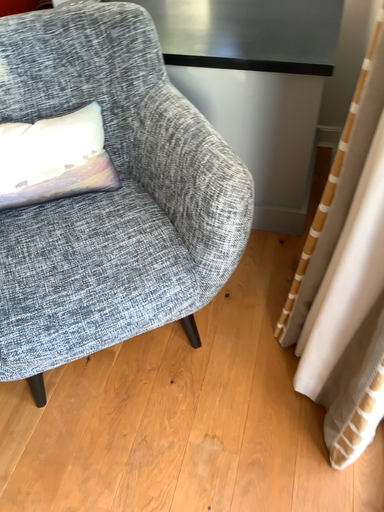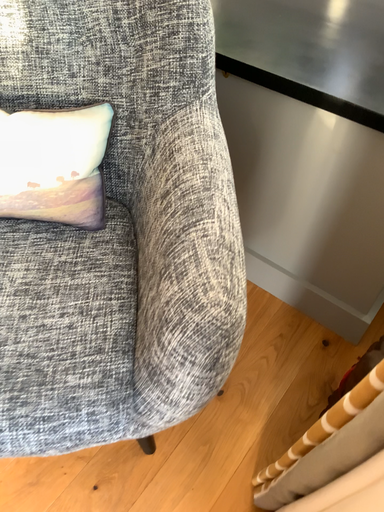
Question: Which way did the camera rotate in the video?

Choices:
 (A) rotated right
 (B) rotated left

Answer: (B)